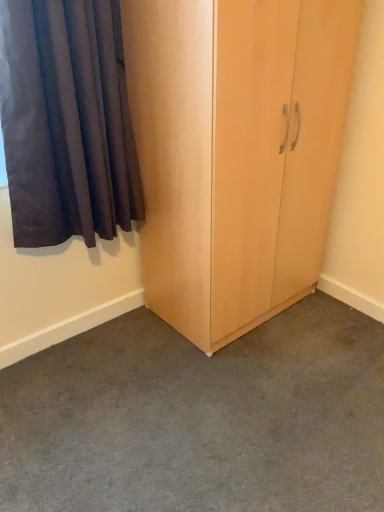
This screenshot has width=384, height=512. In order to click on light wood cupboard at center in this screenshot , I will do `click(235, 152)`.

Locate an element on the screen. carpeted floor at center is located at coordinates (200, 418).

Does point (178, 269) appear closer or farther from the camera than point (279, 366)?

Point (178, 269).

From a real-world perspective, which object rests below the other?

carpeted floor at center.

Based on their positions, is light wood cupboard at center located to the left or right of carpeted floor at center?

From the image, it's evident that light wood cupboard at center is to the right of carpeted floor at center.

Considering the sizes of objects light wood cupboard at center and dark blue fabric curtain at left in the image provided, who is smaller, light wood cupboard at center or dark blue fabric curtain at left?

With smaller size is dark blue fabric curtain at left.

How different are the orientations of light wood cupboard at center and dark blue fabric curtain at left in degrees?

The facing directions of light wood cupboard at center and dark blue fabric curtain at left are 0.367 degrees apart.

From the image's perspective, which is below, light wood cupboard at center or dark blue fabric curtain at left?

light wood cupboard at center is shown below in the image.

Between light wood cupboard at center and dark blue fabric curtain at left, which one has larger width?

light wood cupboard at center is wider.

Is carpeted floor at center wider than dark blue fabric curtain at left?

Indeed, carpeted floor at center has a greater width compared to dark blue fabric curtain at left.

Which of these two, carpeted floor at center or dark blue fabric curtain at left, is bigger?

carpeted floor at center.

Is carpeted floor at center placed right next to dark blue fabric curtain at left?

No, carpeted floor at center is not beside dark blue fabric curtain at left.

Is carpeted floor at center at the right side of dark blue fabric curtain at left?

Indeed, carpeted floor at center is positioned on the right side of dark blue fabric curtain at left.

From a real-world perspective, is dark blue fabric curtain at left above or below light wood cupboard at center?

In terms of real-world spatial position, dark blue fabric curtain at left is above light wood cupboard at center.

Is point (115, 225) positioned before point (170, 92)?

No, (115, 225) is further to viewer.

Consider the image. From the image's perspective, is dark blue fabric curtain at left on top of light wood cupboard at center?

Yes.

In the scene shown: Measure the distance between carpeted floor at center and light wood cupboard at center.

carpeted floor at center is 68.29 centimeters away from light wood cupboard at center.

Does carpeted floor at center appear on the right side of light wood cupboard at center?

No.

From the image's perspective, between carpeted floor at center and light wood cupboard at center, which one is located above?

light wood cupboard at center is shown above in the image.

Between carpeted floor at center and light wood cupboard at center, which one is positioned in front?

carpeted floor at center is more forward.

How many degrees apart are the facing directions of dark blue fabric curtain at left and carpeted floor at center?

The angle between the facing direction of dark blue fabric curtain at left and the facing direction of carpeted floor at center is 88.5 degrees.

From a real-world perspective, is dark blue fabric curtain at left on carpeted floor at center?

Indeed, from a real-world perspective, dark blue fabric curtain at left stands above carpeted floor at center.

Is point (78, 17) less distant than point (302, 408)?

Yes, point (78, 17) is closer to viewer.

You are a GUI agent. You are given a task and a screenshot of the screen. Output one action in this format:
    pyautogui.click(x=<x>, y=<y>)
    Task: Click on the curtain above the carpeted floor at center (from a real-world perspective)
    The image size is (384, 512).
    Given the screenshot: What is the action you would take?
    pyautogui.click(x=67, y=122)

Locate an element on the screen. The width and height of the screenshot is (384, 512). cupboard that is above the carpeted floor at center (from the image's perspective) is located at coordinates (235, 152).

Identify the location of curtain on the left of the light wood cupboard at center. (67, 122).

Looking at the image, which one is located further to dark blue fabric curtain at left, light wood cupboard at center or carpeted floor at center?

carpeted floor at center lies further to dark blue fabric curtain at left than the other object.

Estimate the real-world distances between objects in this image. Which object is further from carpeted floor at center, dark blue fabric curtain at left or light wood cupboard at center?

dark blue fabric curtain at left.

Looking at the image, which one is located closer to dark blue fabric curtain at left, carpeted floor at center or light wood cupboard at center?

Based on the image, light wood cupboard at center appears to be nearer to dark blue fabric curtain at left.

Considering their positions, is light wood cupboard at center positioned further to carpeted floor at center than dark blue fabric curtain at left?

The object further to carpeted floor at center is dark blue fabric curtain at left.

Which object lies nearer to the anchor point light wood cupboard at center, carpeted floor at center or dark blue fabric curtain at left?

dark blue fabric curtain at left.

Estimate the real-world distances between objects in this image. Which object is further from light wood cupboard at center, dark blue fabric curtain at left or carpeted floor at center?

Based on the image, carpeted floor at center appears to be further to light wood cupboard at center.

What are the coordinates of `cupboard between dark blue fabric curtain at left and carpeted floor at center in the up-down direction` in the screenshot? It's located at (235, 152).